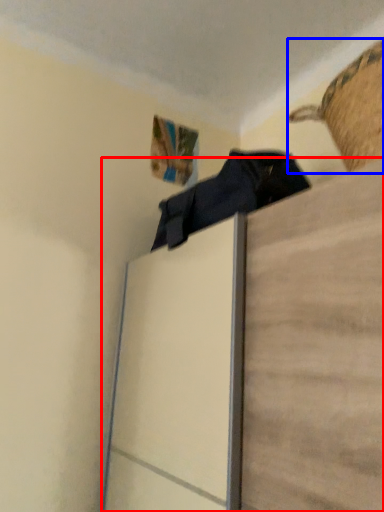
Question: Which object appears farthest to the camera in this image, furniture (highlighted by a red box) or basket (highlighted by a blue box)?

Choices:
 (A) furniture
 (B) basket

Answer: (B)